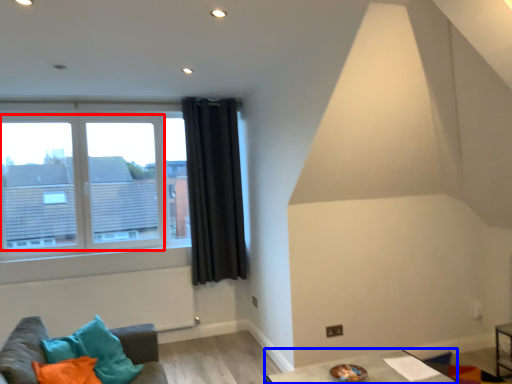
Question: Among these objects, which one is nearest to the camera, bay window (highlighted by a red box) or table (highlighted by a blue box)?

Choices:
 (A) bay window
 (B) table

Answer: (B)